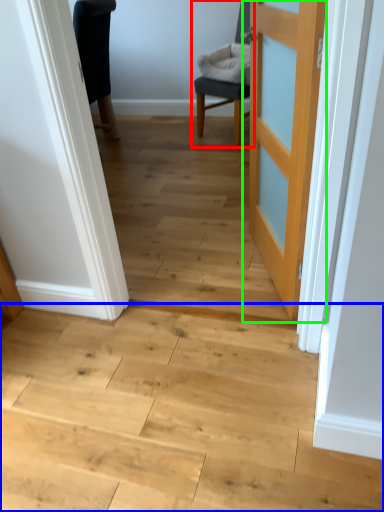
Question: Which object is positioned farthest from chair (highlighted by a red box)? Select from stairwell (highlighted by a blue box) and door (highlighted by a green box).

Choices:
 (A) stairwell
 (B) door

Answer: (A)